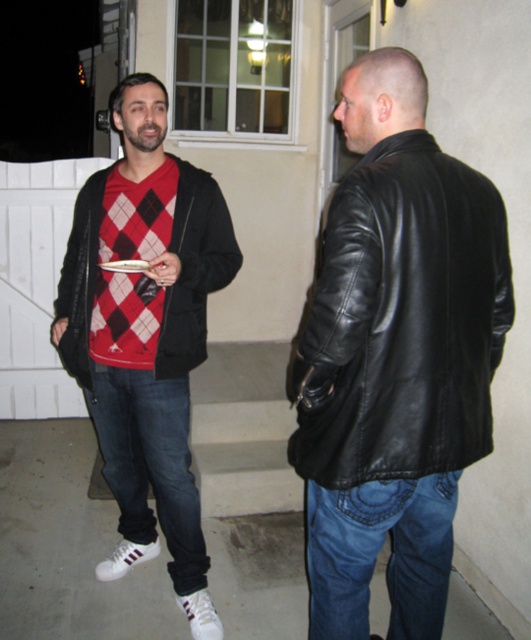
Is denim jeans at lower right further to camera compared to matte black jacket at left?

No, denim jeans at lower right is closer to the viewer.

Is point (434, 524) behind point (228, 232)?

No.

This screenshot has height=640, width=531. Find the location of `denim jeans at lower right`. denim jeans at lower right is located at coordinates (376, 554).

Is matte black hoodie at left to the right of matte black jacket at left from the viewer's perspective?

Correct, you'll find matte black hoodie at left to the right of matte black jacket at left.

Does matte black hoodie at left have a greater height compared to matte black jacket at left?

Indeed, matte black hoodie at left has a greater height compared to matte black jacket at left.

Describe the element at coordinates (145, 333) in the screenshot. I see `matte black hoodie at left` at that location.

The height and width of the screenshot is (640, 531). Identify the location of matte black hoodie at left. (145, 333).

Can you confirm if black leather jacket at right is smaller than denim jeans at lower right?

Actually, black leather jacket at right might be larger than denim jeans at lower right.

The height and width of the screenshot is (640, 531). What do you see at coordinates (402, 321) in the screenshot? I see `black leather jacket at right` at bounding box center [402, 321].

Locate an element on the screen. Image resolution: width=531 pixels, height=640 pixels. black leather jacket at right is located at coordinates (402, 321).